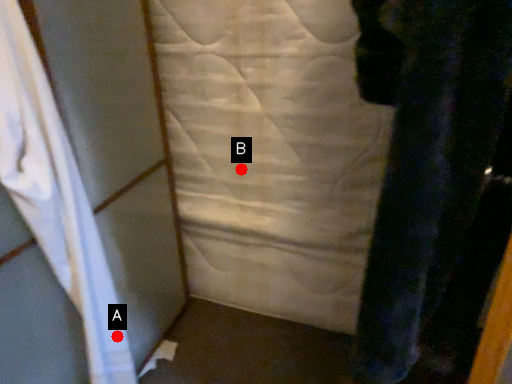
Question: Two points are circled on the image, labeled by A and B beside each circle. Which point appears closest to the camera in this image?

Choices:
 (A) A is closer
 (B) B is closer

Answer: (A)